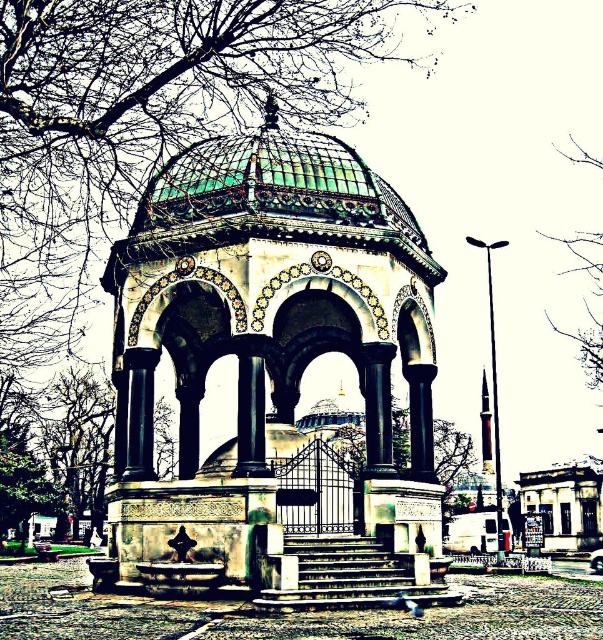
Is white marble gazebo at center further to the viewer compared to bare branches at upper right?

No, white marble gazebo at center is closer to the viewer.

Is white marble gazebo at center smaller than bare branches at upper right?

No, white marble gazebo at center is not smaller than bare branches at upper right.

Which is behind, point (338, 236) or point (599, 326)?

Positioned behind is point (599, 326).

You are a GUI agent. You are given a task and a screenshot of the screen. Output one action in this format:
    pyautogui.click(x=<x>, y=<y>)
    Task: Click on the white marble gazebo at center
    The height and width of the screenshot is (640, 603).
    Given the screenshot: What is the action you would take?
    pyautogui.click(x=264, y=342)